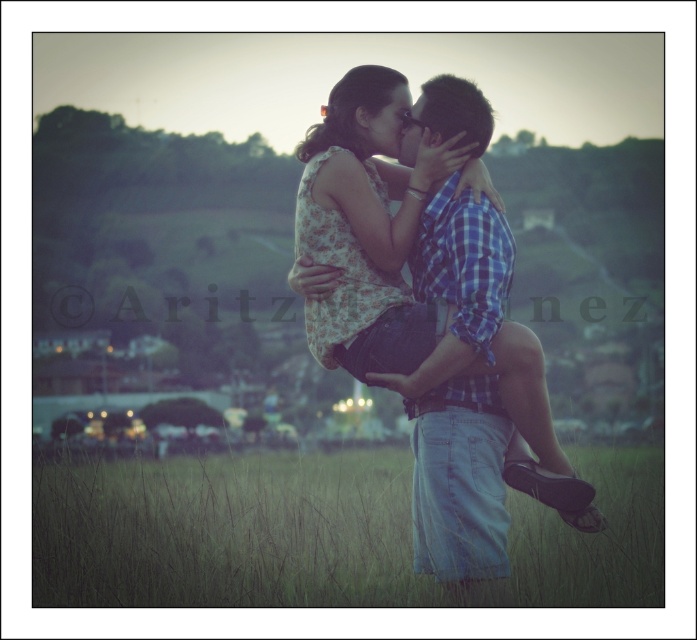
You are a photographer trying to capture the couple in the scene. Since you want to focus on the couple, which object should you zoom in on more, the green grass at lower center or the blue plaid shirt at center?

The blue plaid shirt at center is smaller in size compared to the green grass at lower center, so you should zoom in more on the blue plaid shirt at center to focus on the couple.